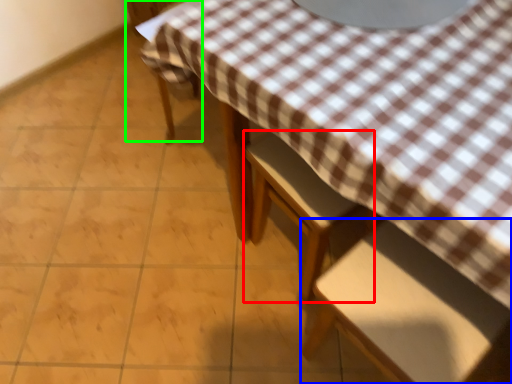
Question: Based on their relative distances, which object is farther from chair (highlighted by a red box)? Choose from chair (highlighted by a blue box) and chair (highlighted by a green box).

Choices:
 (A) chair
 (B) chair

Answer: (B)